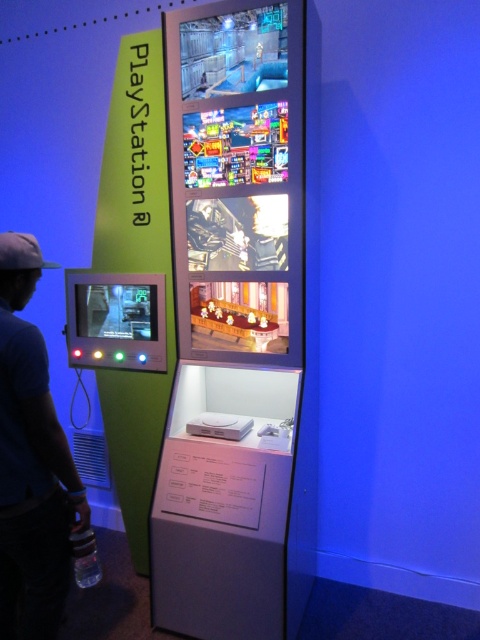
Who is shorter, blue cotton t-shirt at left or black fabric baseball hat at left?

black fabric baseball hat at left

Can you confirm if blue cotton t-shirt at left is wider than black fabric baseball hat at left?

Yes.

The image size is (480, 640). Describe the element at coordinates (32, 461) in the screenshot. I see `blue cotton t-shirt at left` at that location.

Image resolution: width=480 pixels, height=640 pixels. In order to click on blue cotton t-shirt at left in this screenshot , I will do `click(32, 461)`.

Looking at this image, is blue cotton t-shirt at left below clear plastic bottle at lower left?

No.

Between blue cotton t-shirt at left and clear plastic bottle at lower left, which one is positioned higher?

blue cotton t-shirt at left

At what (x,y) coordinates should I click in order to perform the action: click on blue cotton t-shirt at left. Please return your answer as a coordinate pair (x, y). Looking at the image, I should click on (32, 461).

Can you confirm if black fabric baseball hat at left is smaller than clear plastic bottle at lower left?

Incorrect, black fabric baseball hat at left is not smaller in size than clear plastic bottle at lower left.

This screenshot has width=480, height=640. I want to click on black fabric baseball hat at left, so click(22, 252).

Where is `black fabric baseball hat at left`? This screenshot has height=640, width=480. black fabric baseball hat at left is located at coordinates 22,252.